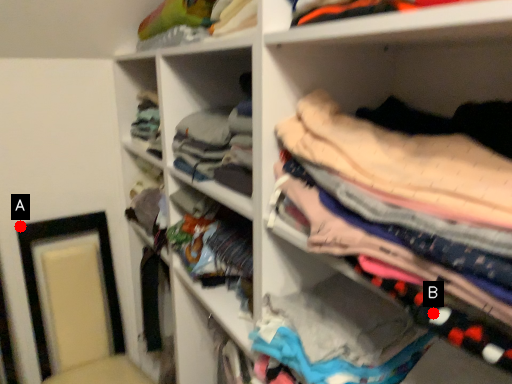
Question: Two points are circled on the image, labeled by A and B beside each circle. Which of the following is the farthest from the observer?

Choices:
 (A) A is further
 (B) B is further

Answer: (A)